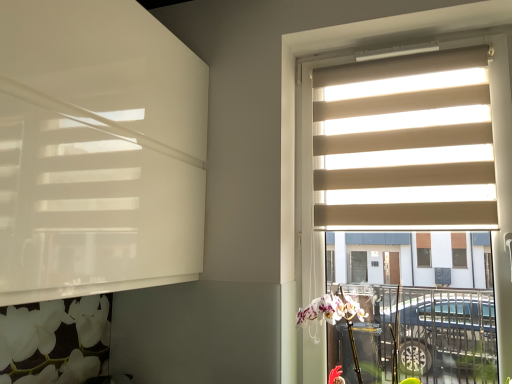
Question: Are beige fabric blinds at upper right and beige fabric blinds at right located far from each other?

Choices:
 (A) no
 (B) yes

Answer: (A)

Question: Does beige fabric blinds at upper right appear on the right side of beige fabric blinds at right?

Choices:
 (A) no
 (B) yes

Answer: (A)

Question: Is beige fabric blinds at upper right positioned in front of beige fabric blinds at right?

Choices:
 (A) no
 (B) yes

Answer: (A)

Question: Considering the relative sizes of beige fabric blinds at upper right and beige fabric blinds at right in the image provided, is beige fabric blinds at upper right thinner than beige fabric blinds at right?

Choices:
 (A) no
 (B) yes

Answer: (B)

Question: Can you confirm if beige fabric blinds at upper right is taller than beige fabric blinds at right?

Choices:
 (A) yes
 (B) no

Answer: (B)

Question: Considering the relative sizes of beige fabric blinds at upper right and beige fabric blinds at right in the image provided, is beige fabric blinds at upper right wider than beige fabric blinds at right?

Choices:
 (A) no
 (B) yes

Answer: (A)

Question: Does beige fabric blinds at right turn towards beige fabric blinds at upper right?

Choices:
 (A) yes
 (B) no

Answer: (A)

Question: Is beige fabric blinds at right wider than beige fabric blinds at upper right?

Choices:
 (A) yes
 (B) no

Answer: (A)

Question: Does beige fabric blinds at right contain beige fabric blinds at upper right?

Choices:
 (A) no
 (B) yes

Answer: (B)

Question: Is beige fabric blinds at right closer to camera compared to beige fabric blinds at upper right?

Choices:
 (A) no
 (B) yes

Answer: (B)

Question: Is beige fabric blinds at right in contact with beige fabric blinds at upper right?

Choices:
 (A) yes
 (B) no

Answer: (B)

Question: From the image's perspective, is beige fabric blinds at right on beige fabric blinds at upper right?

Choices:
 (A) no
 (B) yes

Answer: (A)

Question: From their relative heights in the image, would you say beige fabric blinds at right is taller or shorter than beige fabric blinds at upper right?

Choices:
 (A) tall
 (B) short

Answer: (A)